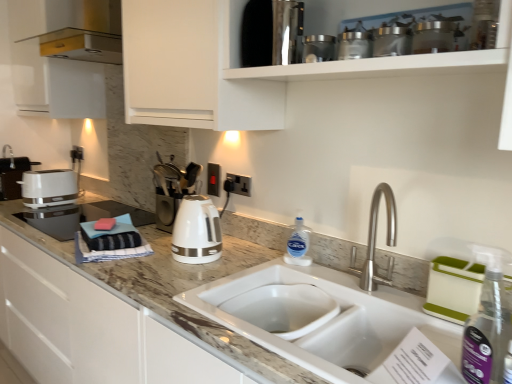
Where is `blank space to the left of clear plastic bottle at sink, arranged as the first bottle when viewed from the left`? This screenshot has width=512, height=384. blank space to the left of clear plastic bottle at sink, arranged as the first bottle when viewed from the left is located at coordinates (251, 259).